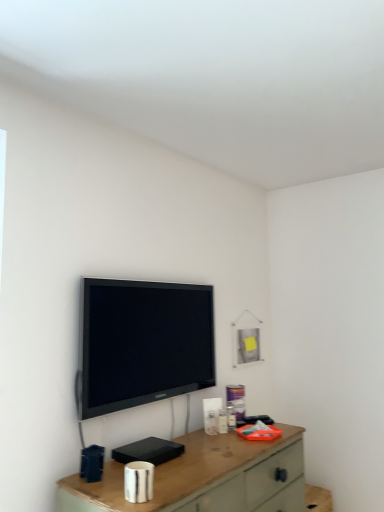
Find the location of `wooden desk at center`. wooden desk at center is located at coordinates (204, 478).

The width and height of the screenshot is (384, 512). Describe the element at coordinates (204, 478) in the screenshot. I see `wooden desk at center` at that location.

Identify the location of black glossy tv at upper center. (x=143, y=343).

This screenshot has width=384, height=512. What do you see at coordinates (143, 343) in the screenshot? I see `black glossy tv at upper center` at bounding box center [143, 343].

The image size is (384, 512). I want to click on wooden desk at center, so click(x=204, y=478).

Is wooden desk at center at the right side of black glossy tv at upper center?

Indeed, wooden desk at center is positioned on the right side of black glossy tv at upper center.

Does wooden desk at center lie behind black glossy tv at upper center?

No, the depth of wooden desk at center is less than that of black glossy tv at upper center.

Is point (186, 436) positioned after point (129, 333)?

That is True.

From the image's perspective, is wooden desk at center above or below black glossy tv at upper center?

Based on their image positions, wooden desk at center is located beneath black glossy tv at upper center.

From a real-world perspective, does wooden desk at center sit lower than black glossy tv at upper center?

Yes.

Which object is thinner, wooden desk at center or black glossy tv at upper center?

black glossy tv at upper center is thinner.

Can you confirm if wooden desk at center is shorter than black glossy tv at upper center?

Yes, wooden desk at center is shorter than black glossy tv at upper center.

Considering the relative sizes of wooden desk at center and black glossy tv at upper center in the image provided, is wooden desk at center smaller than black glossy tv at upper center?

Incorrect, wooden desk at center is not smaller in size than black glossy tv at upper center.

Is wooden desk at center spatially inside black glossy tv at upper center, or outside of it?

wooden desk at center is outside black glossy tv at upper center.

Are wooden desk at center and black glossy tv at upper center making contact?

No, wooden desk at center is not next to black glossy tv at upper center.

Is wooden desk at center facing away from black glossy tv at upper center?

No, wooden desk at center is not facing the opposite direction of black glossy tv at upper center.

Looking at this image, measure the distance from wooden desk at center to black glossy tv at upper center.

18.25 inches.

Locate an element on the screen. television lying on the left of wooden desk at center is located at coordinates (143, 343).

Is black glossy tv at upper center at the right side of wooden desk at center?

In fact, black glossy tv at upper center is to the left of wooden desk at center.

Between black glossy tv at upper center and wooden desk at center, which one is positioned behind?

black glossy tv at upper center is more distant.

Does point (150, 331) come in front of point (242, 442)?

No, it is not.

From the image's perspective, which is above, black glossy tv at upper center or wooden desk at center?

black glossy tv at upper center appears higher in the image.

From a real-world perspective, is black glossy tv at upper center below wooden desk at center?

Actually, black glossy tv at upper center is physically above wooden desk at center in the real world.

Can you confirm if black glossy tv at upper center is thinner than wooden desk at center?

Yes.

Who is shorter, black glossy tv at upper center or wooden desk at center?

wooden desk at center is shorter.

Which of these two, black glossy tv at upper center or wooden desk at center, is smaller?

black glossy tv at upper center is smaller.

Is black glossy tv at upper center positioned beyond the bounds of wooden desk at center?

Yes, black glossy tv at upper center is not within wooden desk at center.

Are black glossy tv at upper center and wooden desk at center beside each other?

No, black glossy tv at upper center is not making contact with wooden desk at center.

Is black glossy tv at upper center oriented away from wooden desk at center?

black glossy tv at upper center is not turned away from wooden desk at center.

From the picture: How many degrees apart are the facing directions of black glossy tv at upper center and wooden desk at center?

0.446 degrees separate the facing orientations of black glossy tv at upper center and wooden desk at center.

This screenshot has height=512, width=384. There is a wooden desk at center. In order to click on television above it (from a real-world perspective) in this screenshot , I will do `click(143, 343)`.

Identify the location of television above the wooden desk at center (from the image's perspective). This screenshot has width=384, height=512. (143, 343).

Locate an element on the screen. desk in front of the black glossy tv at upper center is located at coordinates (204, 478).